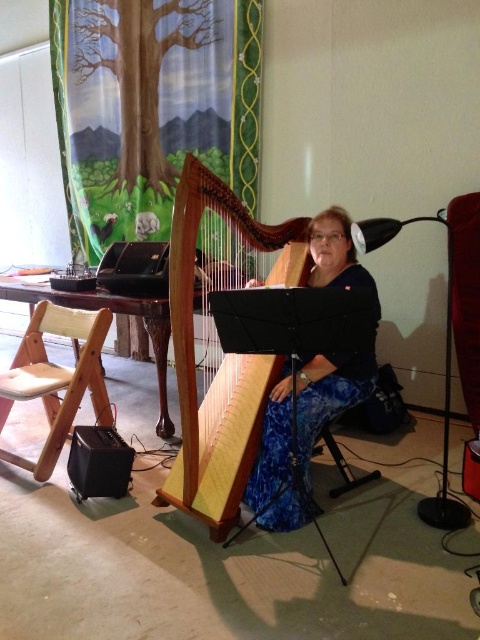
Question: Which object appears farthest from the camera in this image?

Choices:
 (A) wooden harp at center
 (B) light wood folding chair at left
 (C) blue floral pants at center

Answer: (B)

Question: Can you confirm if wooden harp at center is bigger than blue floral pants at center?

Choices:
 (A) no
 (B) yes

Answer: (B)

Question: Where is wooden harp at center located in relation to blue floral pants at center in the image?

Choices:
 (A) below
 (B) above

Answer: (B)

Question: Which object is closer to the camera taking this photo?

Choices:
 (A) blue floral pants at center
 (B) light wood folding chair at left
 (C) wooden harp at center

Answer: (C)

Question: Is wooden harp at center further to the viewer compared to light wood folding chair at left?

Choices:
 (A) no
 (B) yes

Answer: (A)

Question: Which of the following is the farthest from the observer?

Choices:
 (A) (348, 273)
 (B) (63, 440)
 (C) (181, 182)

Answer: (B)